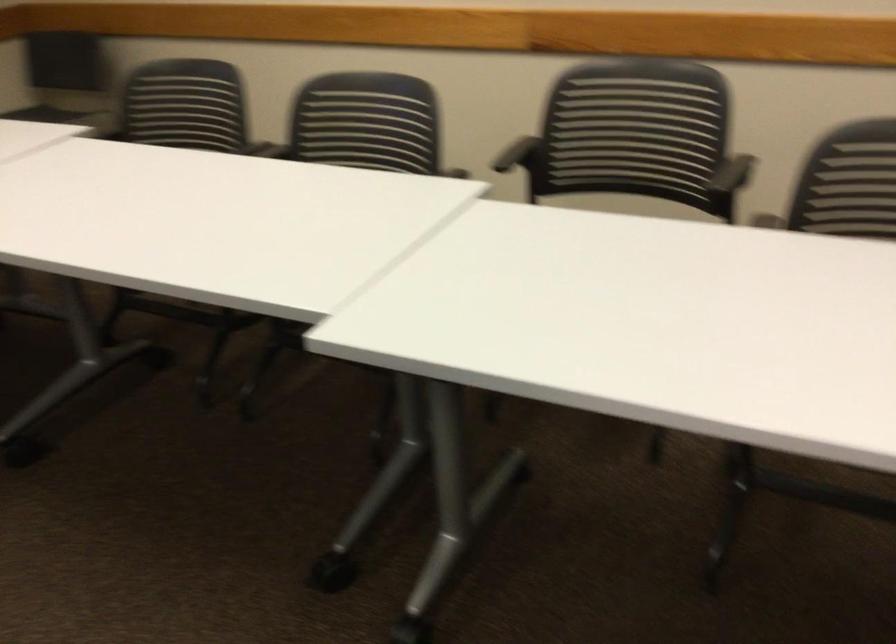
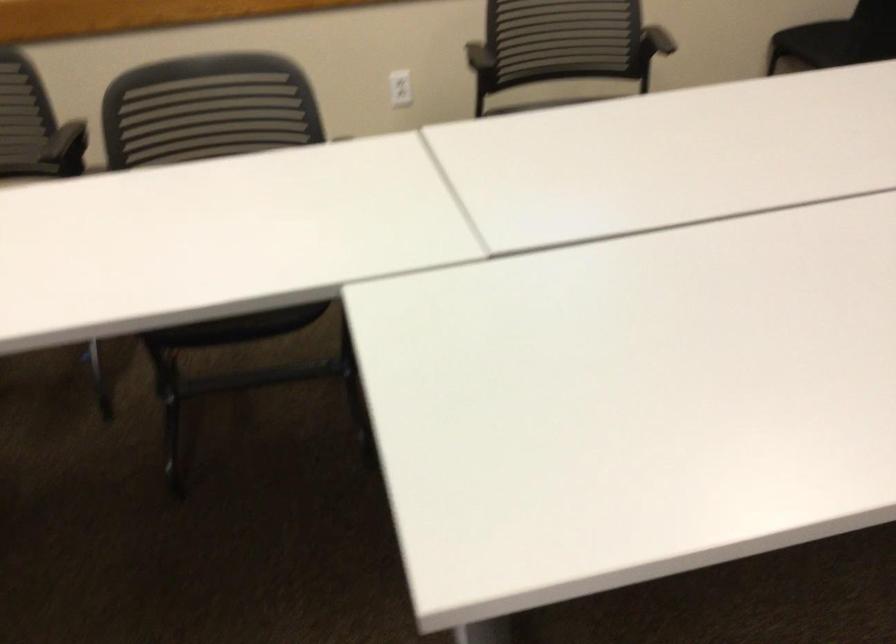
Locate, in the second image, the point that corresponds to pixel 720 182 in the first image.

(67, 149)